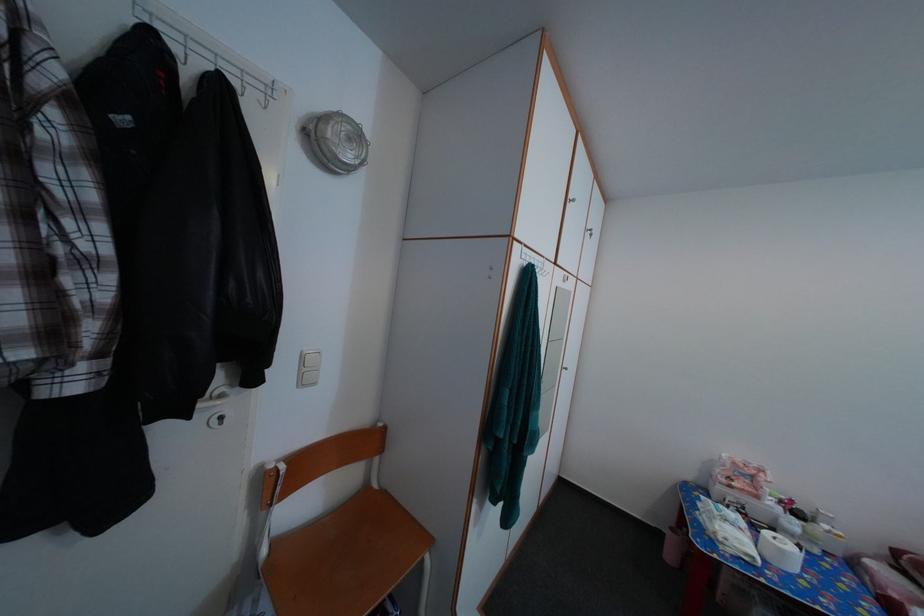
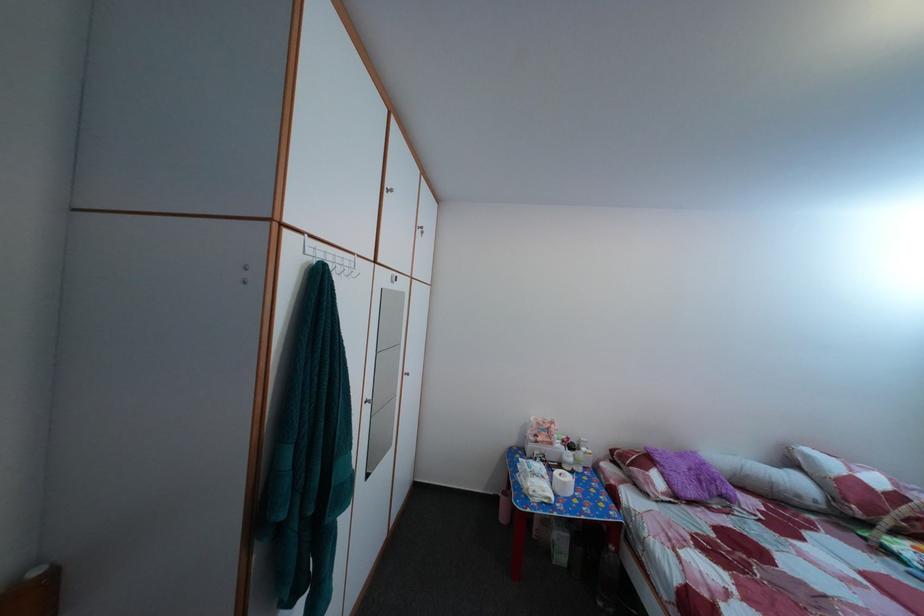
Question: How did the camera likely rotate?

Choices:
 (A) Left
 (B) Right
 (C) Up
 (D) Down

Answer: (B)